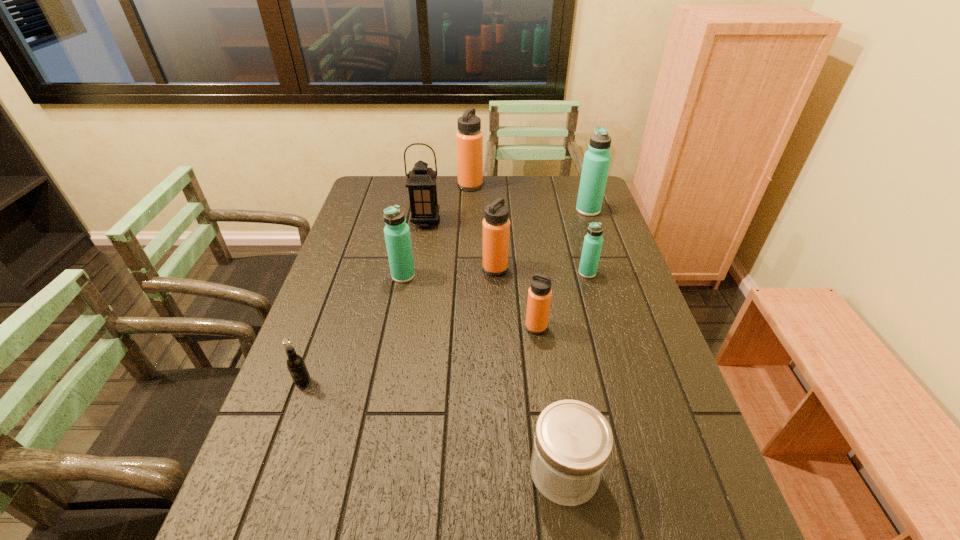
Locate an element on the screen. The height and width of the screenshot is (540, 960). unoccupied position between the smallest aqua thermos bottle and the leftmost object is located at coordinates (445, 327).

You are a GUI agent. You are given a task and a screenshot of the screen. Output one action in this format:
    pyautogui.click(x=<x>, y=<y>)
    Task: Click on the free spot between the smallest aqua thermos bottle and the second biggest orange thermos bottle
    This screenshot has height=540, width=960.
    Given the screenshot: What is the action you would take?
    pyautogui.click(x=541, y=271)

Find the location of a particular element. The width and height of the screenshot is (960, 540). unoccupied area between the leftmost thermos bottle and the smallest orange thermos bottle is located at coordinates (469, 301).

Where is `vacant region between the biggest orange thermos bottle and the second biggest aqua thermos bottle`? The height and width of the screenshot is (540, 960). vacant region between the biggest orange thermos bottle and the second biggest aqua thermos bottle is located at coordinates (437, 231).

Where is `free space between the farthest thermos bottle and the second smallest aqua thermos bottle`? The height and width of the screenshot is (540, 960). free space between the farthest thermos bottle and the second smallest aqua thermos bottle is located at coordinates (437, 231).

The image size is (960, 540). I want to click on unoccupied position between the biggest orange thermos bottle and the leftmost object, so click(x=387, y=284).

This screenshot has height=540, width=960. Identify the location of empty space that is in between the lantern and the root beer. (365, 302).

What are the coordinates of `object that ranks as the eighth closest to the leftmost aqua thermos bottle` in the screenshot? It's located at (596, 163).

Point out which object is positioned as the fourth nearest to the leftmost thermos bottle. Please provide its 2D coordinates. Your answer should be formatted as a tuple, i.e. [(x, y)], where the tuple contains the x and y coordinates of a point satisfying the conditions above.

[(295, 363)]

Locate an element on the screen. The width and height of the screenshot is (960, 540). the closest thermos bottle to the black lantern is located at coordinates (469, 138).